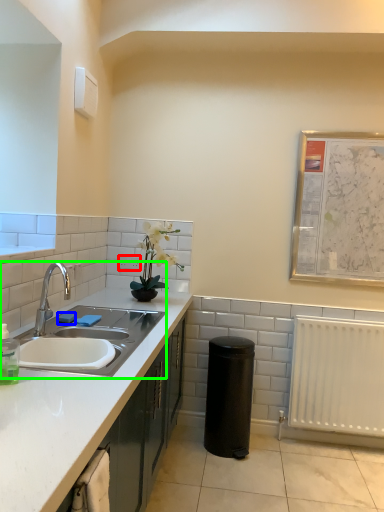
Question: Which is farther away from electric outlet (highlighted by a red box)? soap (highlighted by a blue box) or sink (highlighted by a green box)?

Choices:
 (A) soap
 (B) sink

Answer: (B)